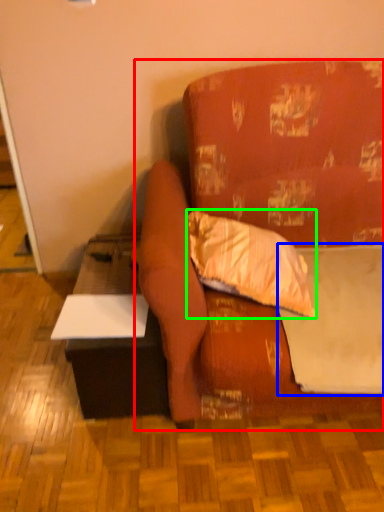
Question: Based on their relative distances, which object is nearer to studio couch (highlighted by a red box)? Choose from sheet (highlighted by a blue box) and pillow (highlighted by a green box).

Choices:
 (A) sheet
 (B) pillow

Answer: (B)